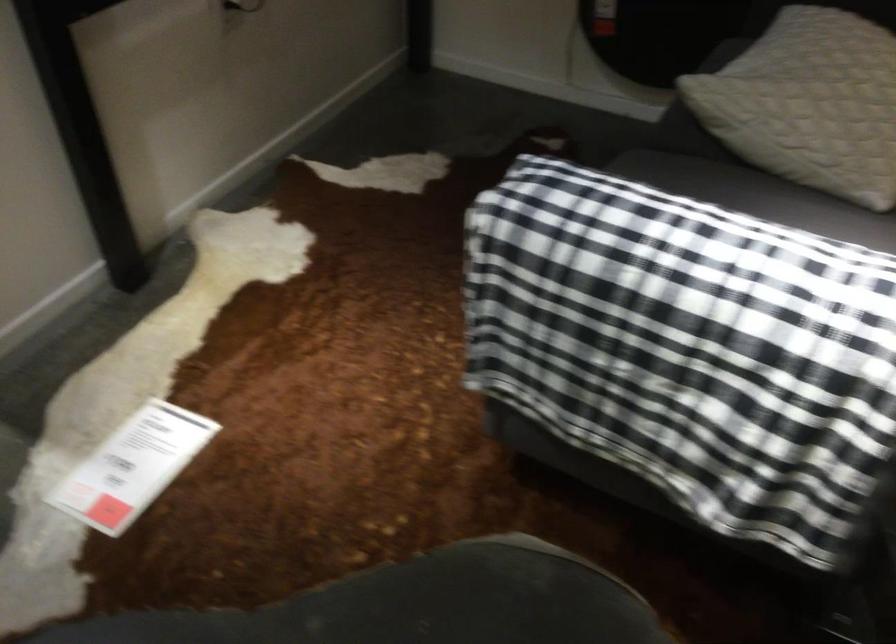
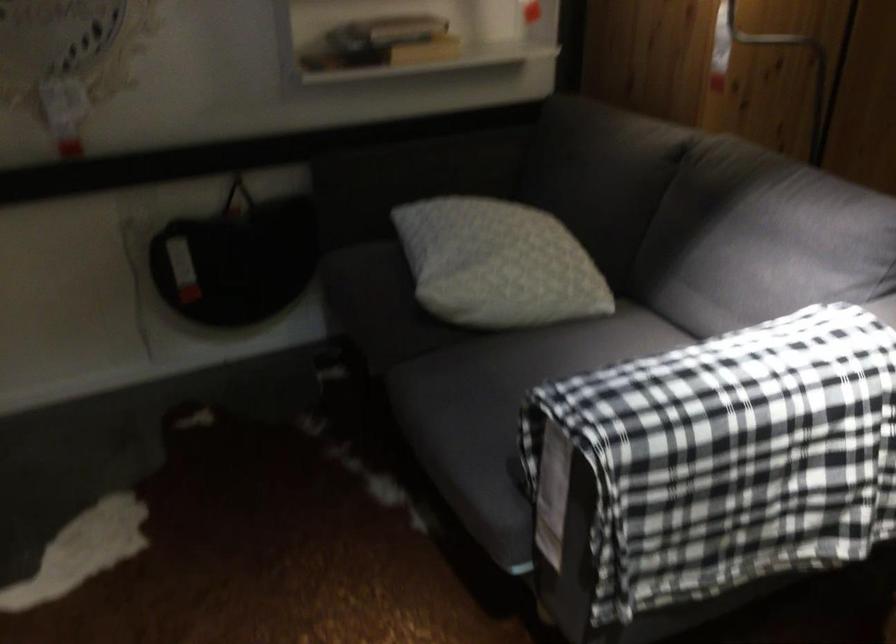
Question: The images are taken continuously from a first-person perspective. In which direction is your viewpoint rotating?

Choices:
 (A) Left
 (B) Right
 (C) Up
 (D) Down

Answer: (B)